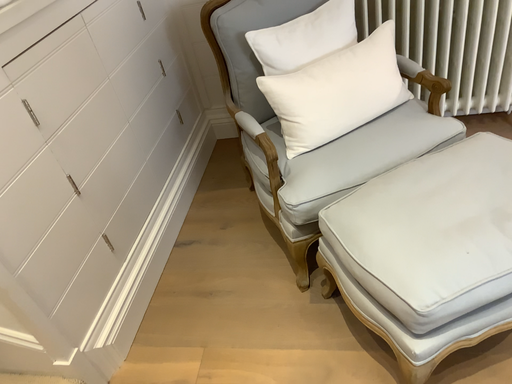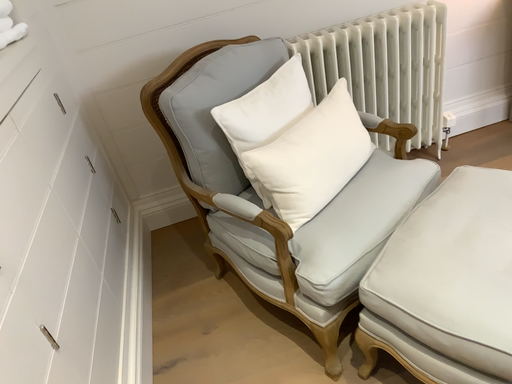
Question: Which way did the camera rotate in the video?

Choices:
 (A) rotated left
 (B) rotated right

Answer: (B)